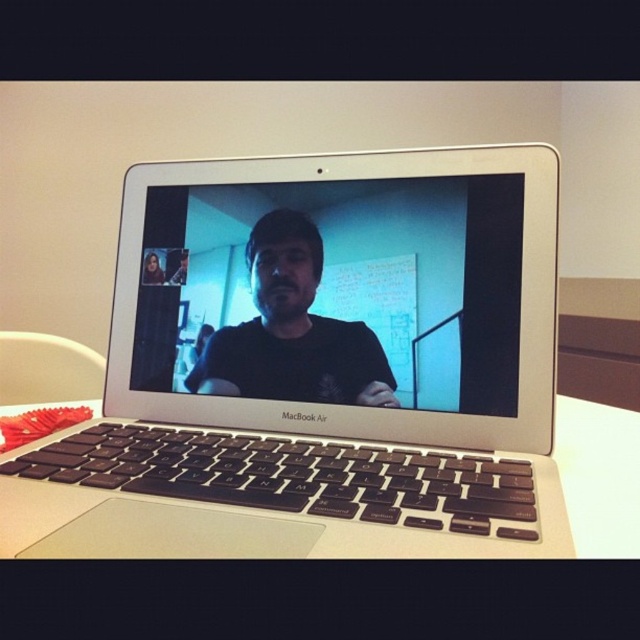
Question: Which point is closer to the camera?

Choices:
 (A) white matte table at center
 (B) black matte shirt at center

Answer: (A)

Question: Can you confirm if matte black laptop at center is positioned above white matte table at center?

Choices:
 (A) no
 (B) yes

Answer: (B)

Question: Which object appears closest to the camera in this image?

Choices:
 (A) black matte shirt at center
 (B) matte black laptop at center

Answer: (B)

Question: Observing the image, what is the correct spatial positioning of matte black laptop at center in reference to white matte table at center?

Choices:
 (A) above
 (B) below

Answer: (A)

Question: Which of the following is the farthest from the observer?

Choices:
 (A) silver metallic laptop at center
 (B) white matte table at center

Answer: (B)

Question: Does silver metallic laptop at center appear on the left side of white matte table at center?

Choices:
 (A) yes
 (B) no

Answer: (A)